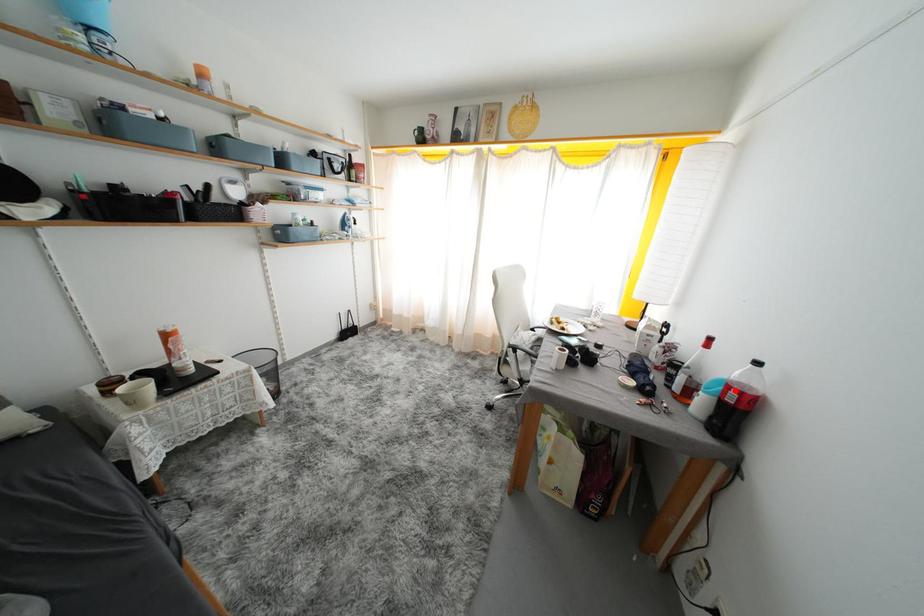
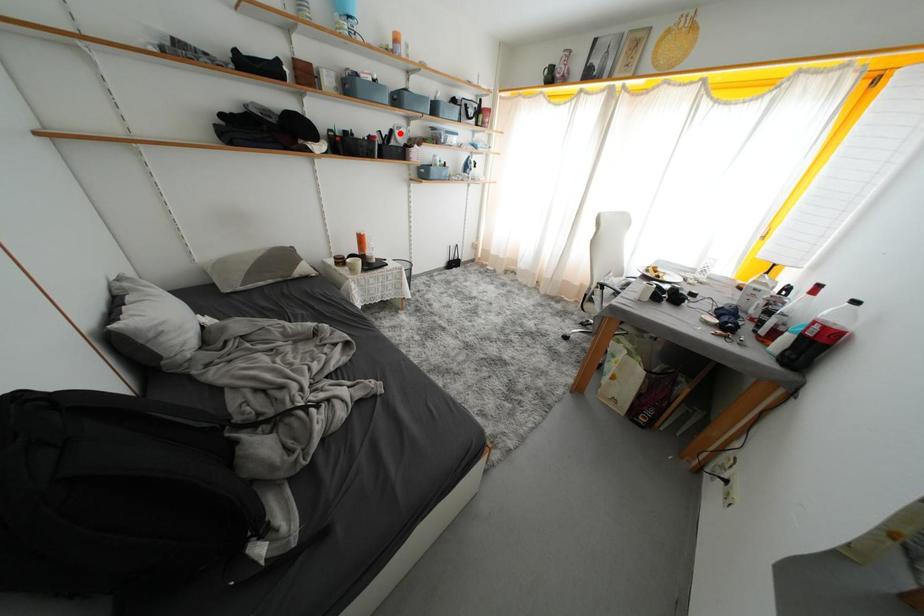
I am providing you with two images of the same scene from different viewpoints. A red point is marked on the first image and another point is marked on the second image. Do the highlighted points in image1 and image2 indicate the same real-world spot?

No